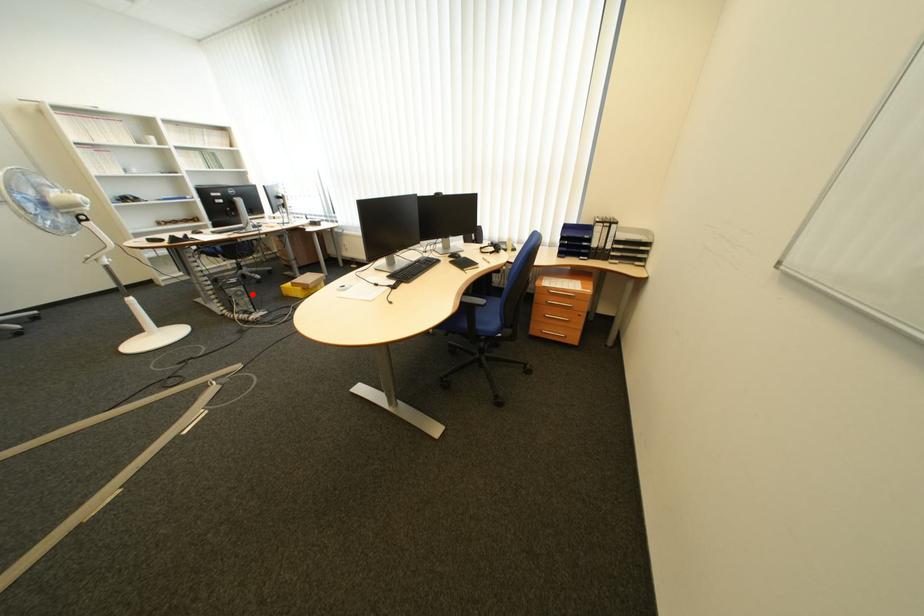
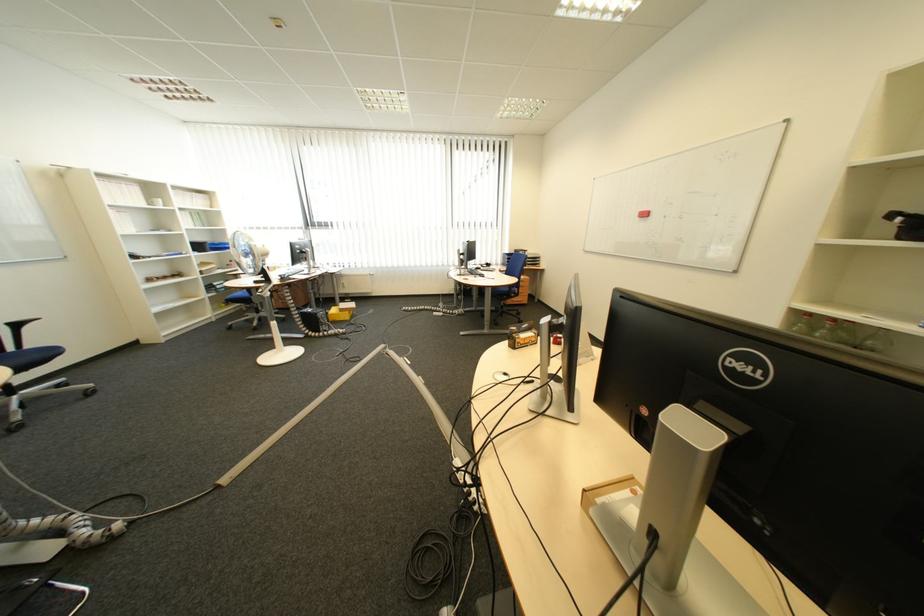
In the second image, find the point that corresponds to the highlighted location in the first image.

(335, 317)